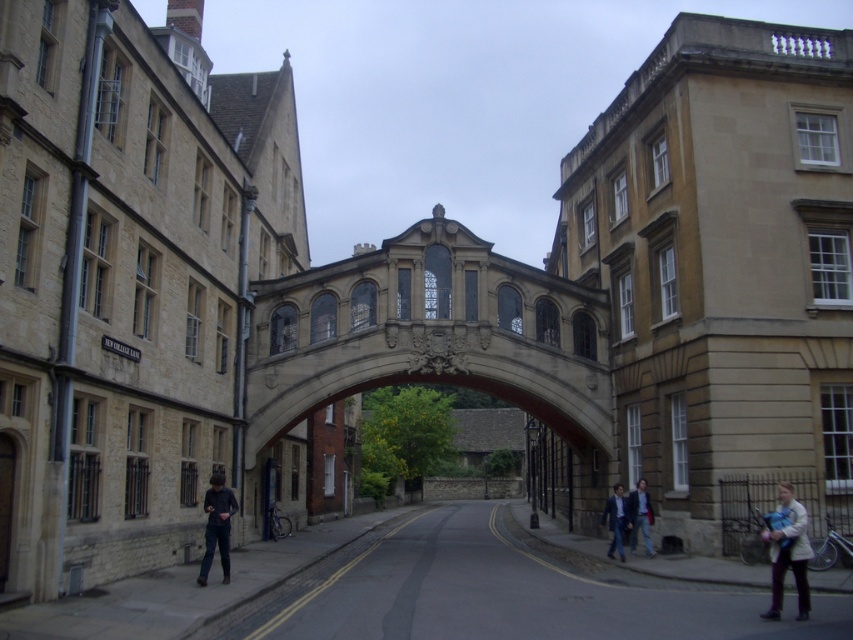
You are standing on the Bridge of Sighs in Oxford and notice a smooth stone alley at center and dark blue jeans at lower left. From your perspective on the bridge, which object is positioned to the right?

The smooth stone alley at center is to the right of dark blue jeans at lower left.

You are standing on the Bridge of Sighs in Oxford and notice two items on the ground below you. One is dark blue jeans at lower left and the other is light blue denim jacket at lower right. Which item is closer to your left side when facing the bridge?

The dark blue jeans at lower left is positioned on the left side of light blue denim jacket at lower right, so when facing the bridge, the dark blue jeans at lower left would be closer to your left side.